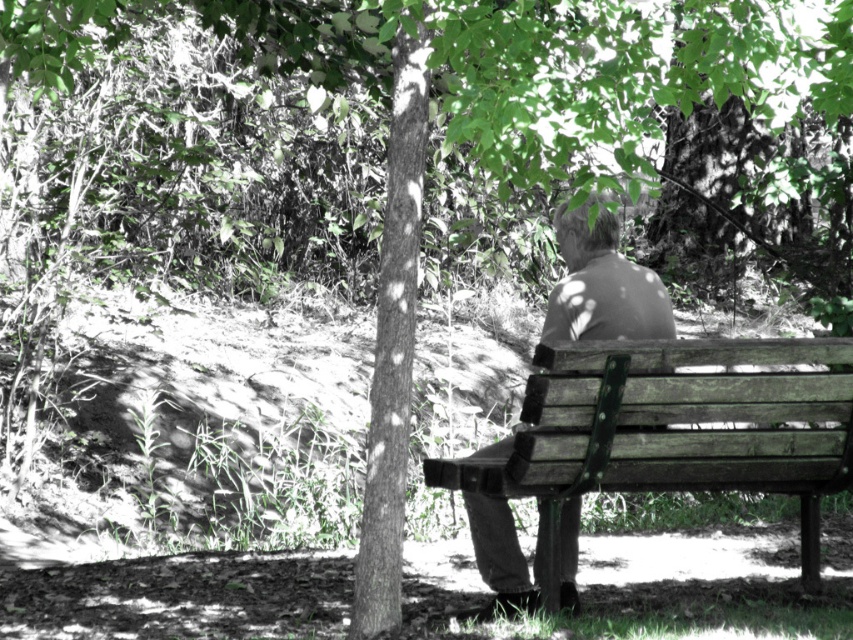
Question: Is wooden bench at lower right thinner than matte brown jacket at center?

Choices:
 (A) yes
 (B) no

Answer: (B)

Question: Among these points, which one is farthest from the camera?

Choices:
 (A) (471, 490)
 (B) (631, 280)

Answer: (B)

Question: Is wooden bench at lower right thinner than matte brown jacket at center?

Choices:
 (A) no
 (B) yes

Answer: (A)

Question: Does wooden bench at lower right appear over matte brown jacket at center?

Choices:
 (A) yes
 (B) no

Answer: (B)

Question: Which point is farther to the camera?

Choices:
 (A) (604, 445)
 (B) (584, 336)

Answer: (B)